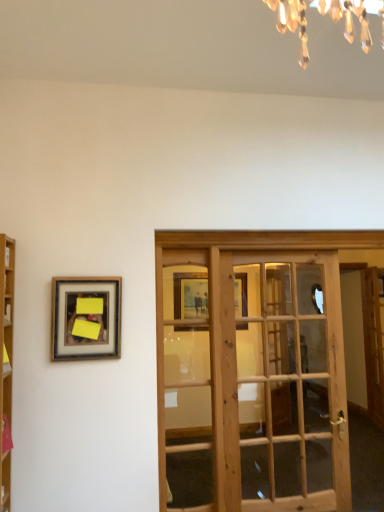
Question: Would you say wooden french door at center is outside wooden bookshelf at left?

Choices:
 (A) yes
 (B) no

Answer: (A)

Question: Can you see wooden french door at center touching wooden bookshelf at left?

Choices:
 (A) yes
 (B) no

Answer: (B)

Question: Does wooden french door at center have a larger size compared to wooden bookshelf at left?

Choices:
 (A) no
 (B) yes

Answer: (B)

Question: Is wooden french door at center not near wooden bookshelf at left?

Choices:
 (A) yes
 (B) no

Answer: (A)

Question: Is wooden french door at center closer to the viewer compared to wooden bookshelf at left?

Choices:
 (A) no
 (B) yes

Answer: (A)

Question: Visually, is wooden french door at center positioned to the left or to the right of wooden bookshelf at left?

Choices:
 (A) left
 (B) right

Answer: (B)

Question: From a real-world perspective, is wooden french door at center physically located above or below wooden bookshelf at left?

Choices:
 (A) below
 (B) above

Answer: (A)

Question: Is wooden french door at center spatially inside wooden bookshelf at left, or outside of it?

Choices:
 (A) outside
 (B) inside

Answer: (A)

Question: Is point pos(279,313) closer or farther from the camera than point pos(6,294)?

Choices:
 (A) closer
 (B) farther

Answer: (B)

Question: Is wooden french door at center inside the boundaries of wooden framed picture at left, or outside?

Choices:
 (A) inside
 (B) outside

Answer: (B)

Question: From a real-world perspective, is wooden french door at center positioned above or below wooden framed picture at left?

Choices:
 (A) below
 (B) above

Answer: (A)

Question: In terms of width, does wooden french door at center look wider or thinner when compared to wooden framed picture at left?

Choices:
 (A) wide
 (B) thin

Answer: (A)

Question: Is wooden french door at center to the left or to the right of wooden framed picture at left in the image?

Choices:
 (A) left
 (B) right

Answer: (B)

Question: From the image's perspective, is wooden bookshelf at left located above or below wooden framed picture at left?

Choices:
 (A) above
 (B) below

Answer: (B)

Question: Based on their positions, is wooden bookshelf at left located to the left or right of wooden framed picture at left?

Choices:
 (A) right
 (B) left

Answer: (B)